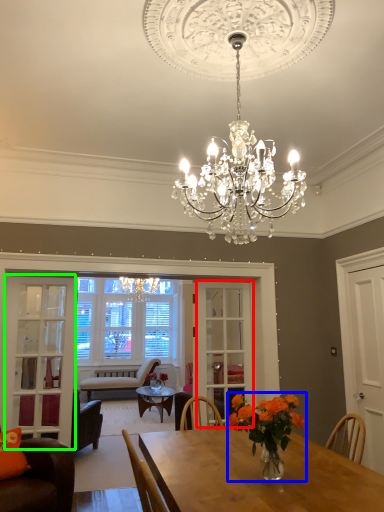
Question: Considering the real-world distances, which object is closest to glass door (highlighted by a red box)? floral arrangement (highlighted by a blue box) or glass door (highlighted by a green box).

Choices:
 (A) floral arrangement
 (B) glass door

Answer: (B)